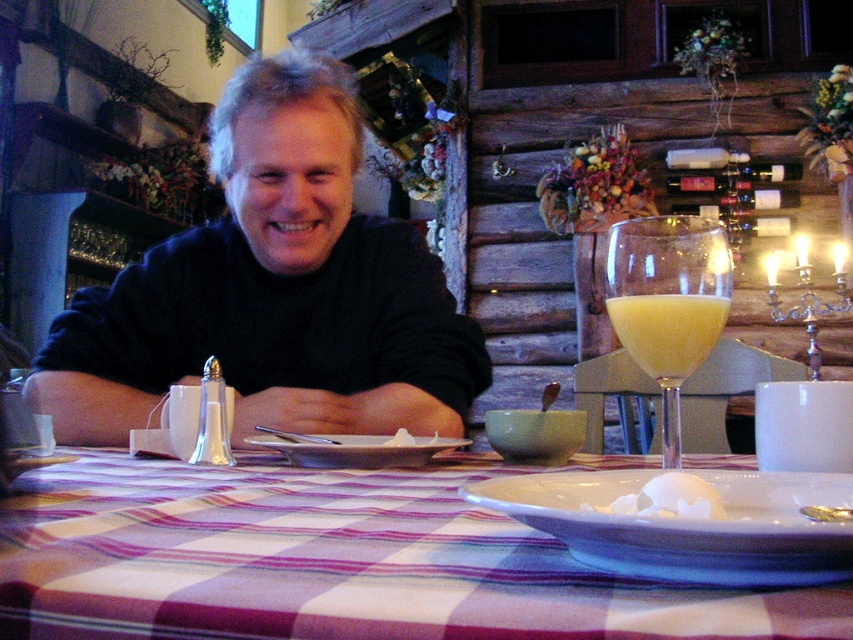
Question: Does yellow translucent wine glass at right appear on the left side of white matte plate at center?

Choices:
 (A) yes
 (B) no

Answer: (B)

Question: Based on their relative distances, which object is nearer to the black matte sweater at center?

Choices:
 (A) white glossy plate at lower right
 (B) yellow frothy liquid at center

Answer: (B)

Question: Estimate the real-world distances between objects in this image. Which object is closer to the white creamy egg at center?

Choices:
 (A) black matte sweater at center
 (B) satin silver spoon at center
 (C) white matte plate at center
 (D) white glossy plate at lower right

Answer: (D)

Question: Is the position of black matte sweater at center less distant than that of yellow frothy liquid at center?

Choices:
 (A) yes
 (B) no

Answer: (B)

Question: Does plaid fabric at center have a lesser width compared to white creamy egg at center?

Choices:
 (A) yes
 (B) no

Answer: (B)

Question: Which object is the farthest from the white glossy plate at lower right?

Choices:
 (A) yellow translucent wine glass at right
 (B) satin silver spoon at center
 (C) plaid fabric at center
 (D) white matte plate at center

Answer: (B)